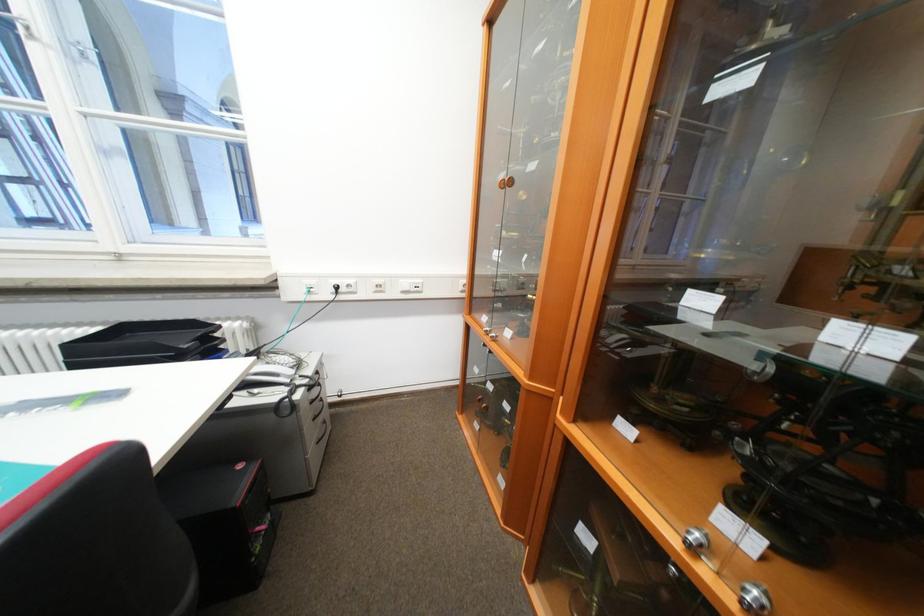
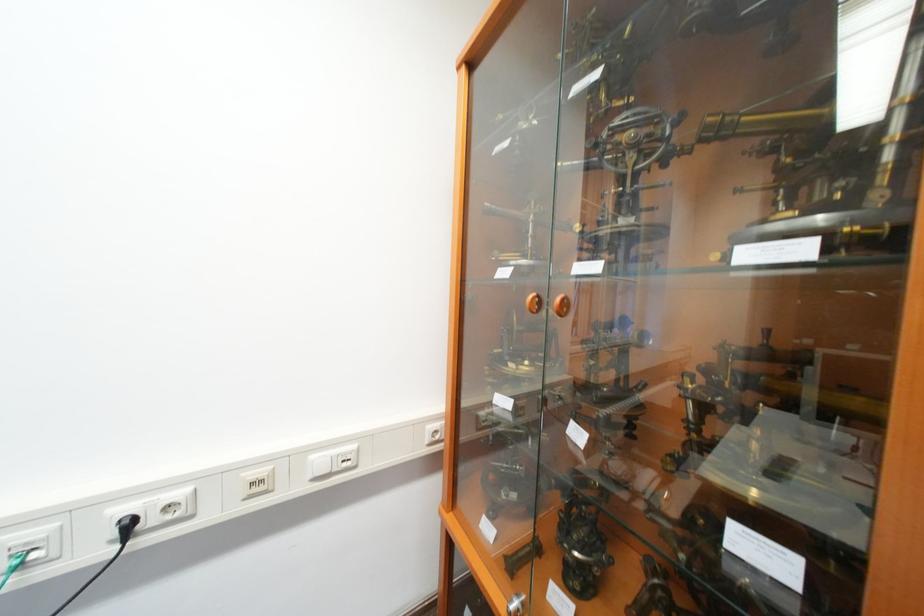
Question: The camera is either moving clockwise (left) or counter-clockwise (right) around the object. The first image is from the beginning of the video and the second image is from the end. Is the camera moving left or right when shooting the video?

Choices:
 (A) Left
 (B) Right

Answer: (A)